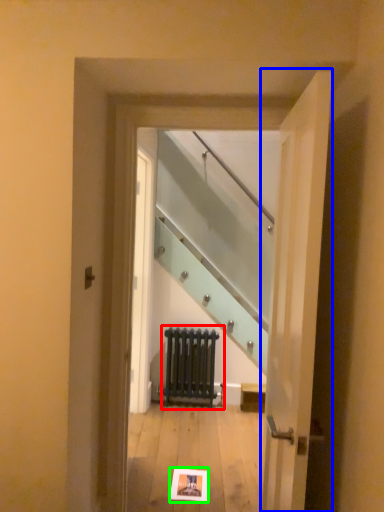
Question: Which object is positioned farthest from radiator (highlighted by a red box)? Select from door (highlighted by a blue box) and postcard (highlighted by a green box).

Choices:
 (A) door
 (B) postcard

Answer: (A)